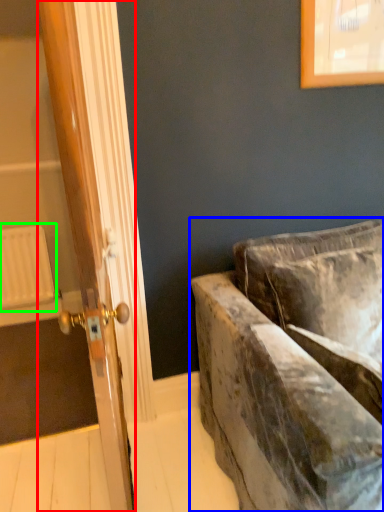
Question: Which object is positioned closest to door (highlighted by a red box)? Select from studio couch (highlighted by a blue box) and radiator (highlighted by a green box).

Choices:
 (A) studio couch
 (B) radiator

Answer: (A)